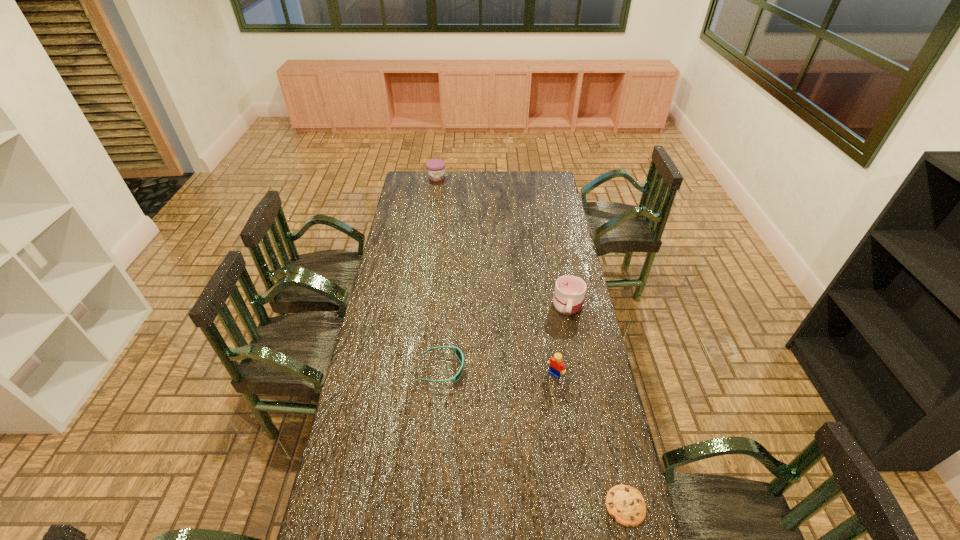
The width and height of the screenshot is (960, 540). In order to click on cookie located at the right edge in this screenshot , I will do `click(625, 504)`.

Find the location of a particular element. This screenshot has height=540, width=960. mug that is at the right edge is located at coordinates (569, 293).

I want to click on Lego that is positioned at the right edge, so click(x=557, y=367).

In order to click on object present at the far left corner in this screenshot , I will do `click(435, 167)`.

Find the location of a particular element. The width and height of the screenshot is (960, 540). object that is at the near right corner is located at coordinates (625, 504).

What are the coordinates of `vacant space at the far edge of the desktop` in the screenshot? It's located at (505, 187).

The height and width of the screenshot is (540, 960). I want to click on free space at the left edge, so click(x=406, y=306).

Find the location of `free spot at the right edge of the desktop`. free spot at the right edge of the desktop is located at coordinates (566, 370).

At what (x,y) coordinates should I click in order to perform the action: click on vacant space in between the fourth nearest object and the farthest object. Please return your answer as a coordinate pair (x, y). This screenshot has width=960, height=540. Looking at the image, I should click on (502, 241).

At what (x,y) coordinates should I click in order to perform the action: click on blank region between the shortest object and the Lego. Please return your answer as a coordinate pair (x, y). Looking at the image, I should click on (590, 440).